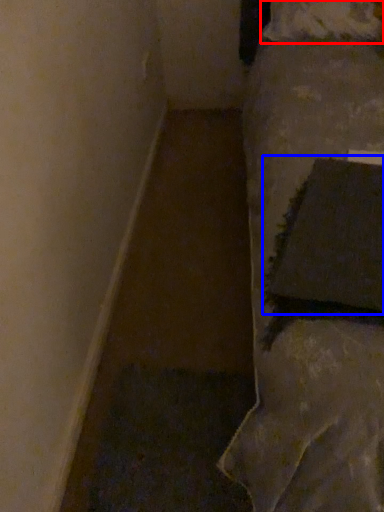
Question: Which point is further to the camera, pillow (highlighted by a red box) or pillow (highlighted by a blue box)?

Choices:
 (A) pillow
 (B) pillow

Answer: (A)